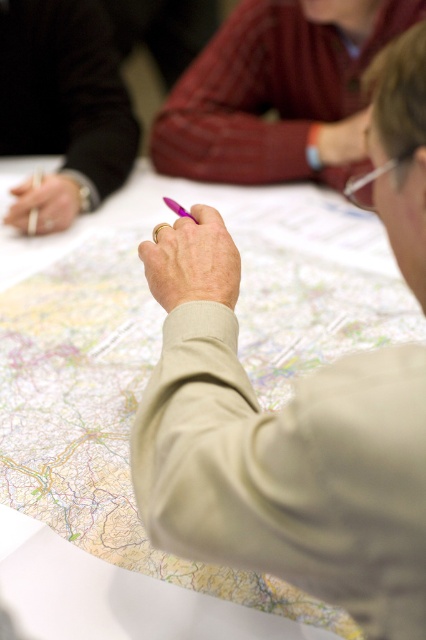
Who is taller, matte black pen at upper left or purple plastic pen at center?

matte black pen at upper left

What do you see at coordinates (63, 104) in the screenshot? Image resolution: width=426 pixels, height=640 pixels. I see `matte black pen at upper left` at bounding box center [63, 104].

This screenshot has height=640, width=426. I want to click on matte black pen at upper left, so click(63, 104).

Does point (388, 36) lie behind point (172, 208)?

Yes, it is.

Does matte red sweater at upper center have a smaller size compared to purple plastic pen at center?

No, matte red sweater at upper center is not smaller than purple plastic pen at center.

Does point (365, 116) come behind point (166, 202)?

Yes, it is behind point (166, 202).

Identify the location of matte red sweater at upper center. [x=279, y=92].

Can you confirm if beige paper map at center is positioned to the left of matte red sweater at upper center?

Yes, beige paper map at center is to the left of matte red sweater at upper center.

Is beige paper map at center smaller than matte red sweater at upper center?

No, beige paper map at center is not smaller than matte red sweater at upper center.

Which is behind, point (8, 168) or point (224, 152)?

Point (8, 168)

You are a GUI agent. You are given a task and a screenshot of the screen. Output one action in this format:
    pyautogui.click(x=<x>, y=<y>)
    Task: Click on the beige paper map at center
    This screenshot has height=640, width=426.
    Given the screenshot: What is the action you would take?
    pyautogui.click(x=209, y=204)